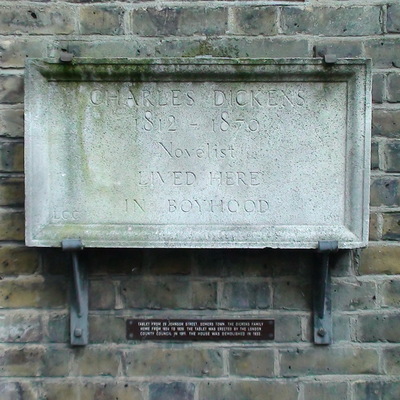
The height and width of the screenshot is (400, 400). Find the location of `metal sign`. metal sign is located at coordinates (206, 332).